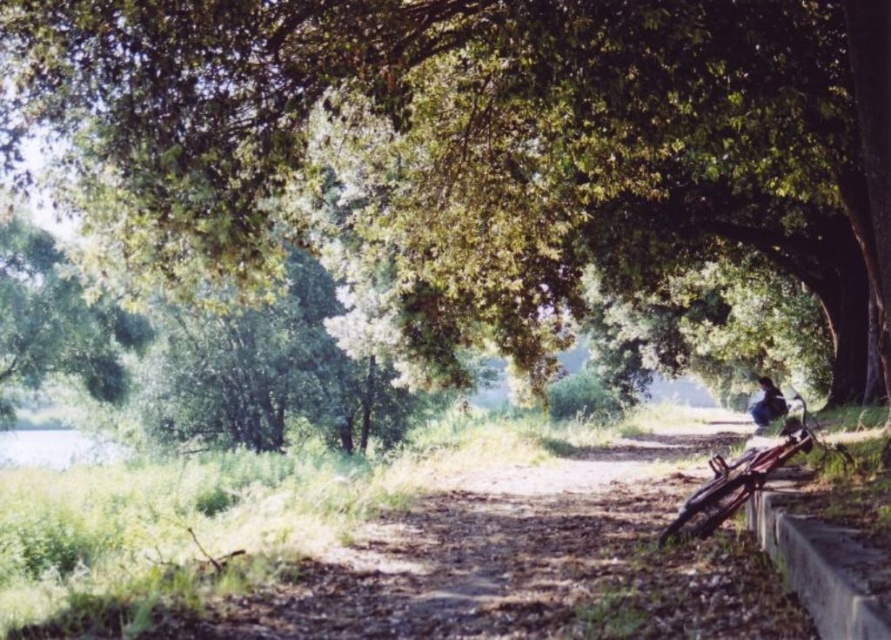
Is green leafy tree at center above dark blue fabric at lower right?

Correct, green leafy tree at center is located above dark blue fabric at lower right.

Who is positioned more to the right, green leafy tree at center or dark blue fabric at lower right?

Positioned to the right is dark blue fabric at lower right.

Does point (528, 26) come farther from viewer compared to point (772, 404)?

No, (528, 26) is in front of (772, 404).

What are the coordinates of `green leafy tree at center` in the screenshot? It's located at (484, 145).